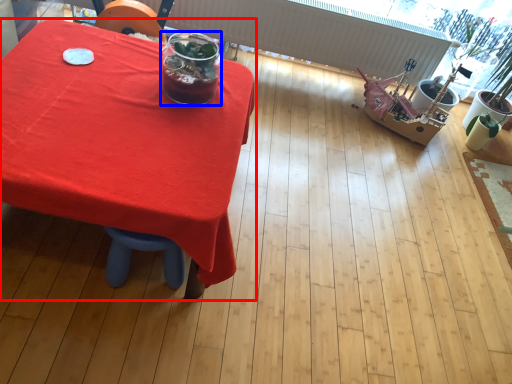
Question: Which point is further to the camera, table (highlighted by a red box) or drink (highlighted by a blue box)?

Choices:
 (A) table
 (B) drink

Answer: (B)